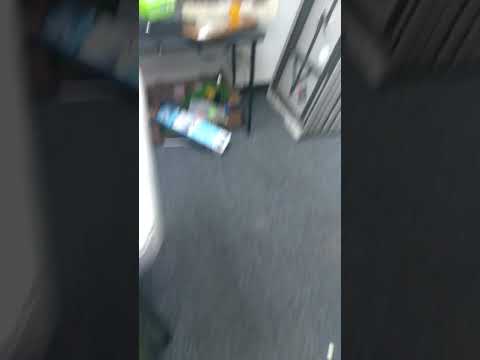
Locate an element on the screen. stack of tables is located at coordinates (317, 52), (328, 84), (333, 87), (334, 93), (334, 101).